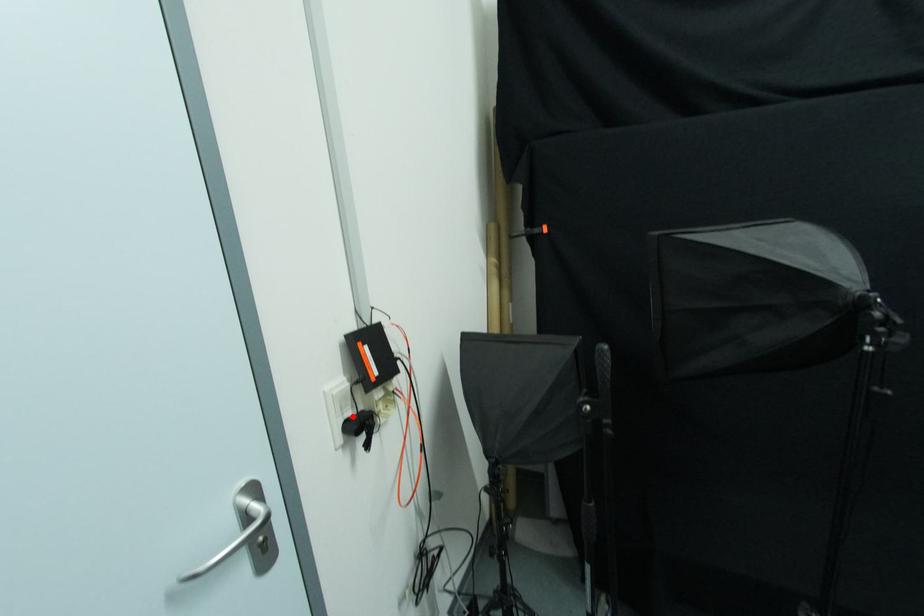
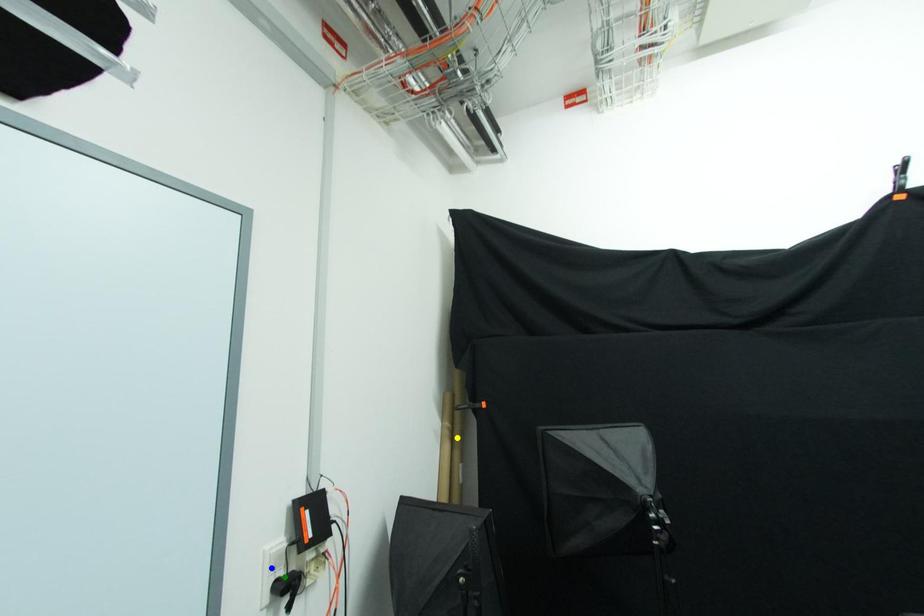
Question: I am providing you with two images of the same scene from different viewpoints. A red point is marked on the first image. You are given multiple points on the second image. Which spot in image 2 lines up with the point in image 1?

Choices:
 (A) blue point
 (B) yellow point
 (C) green point

Answer: (C)